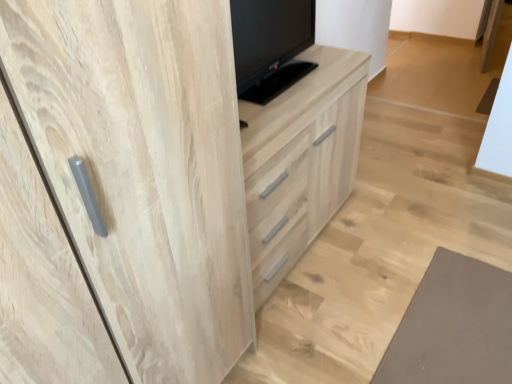
The image size is (512, 384). I want to click on light wood cabinet at center, so click(x=301, y=160).

In order to face light wood cabinet at center, should I rotate leftwards or rightwards?

Turn right by 2.205 degrees to look at light wood cabinet at center.

What do you see at coordinates (301, 160) in the screenshot? This screenshot has height=384, width=512. I see `light wood cabinet at center` at bounding box center [301, 160].

Where is `light wood cabinet at center`? light wood cabinet at center is located at coordinates (301, 160).